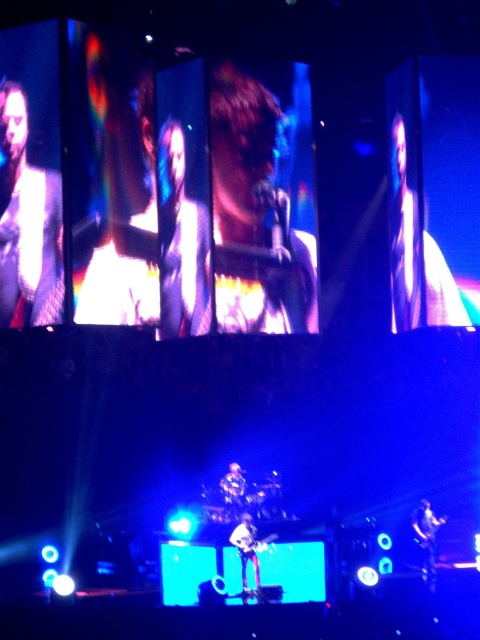
You are a photographer at the concert. You want to take a photo that includes both the shiny silver guitar at center and the shiny silver microphone at center. Based on their positions, which object will appear larger in the photo?

The shiny silver guitar at center will appear larger in the photo because it is positioned in front of the shiny silver microphone at center, making it closer to the camera.

You are a photographer at the concert and want to capture both the shiny silver guitar at lower right and the shiny silver microphone at center in a single frame. Which object should you focus on first if you want to ensure both are fully visible without cropping?

You should focus on the shiny silver guitar at lower right first because its width is greater than the shiny silver microphone at center, so ensuring the wider object is centered will allow more flexibility to include the narrower microphone in the frame.